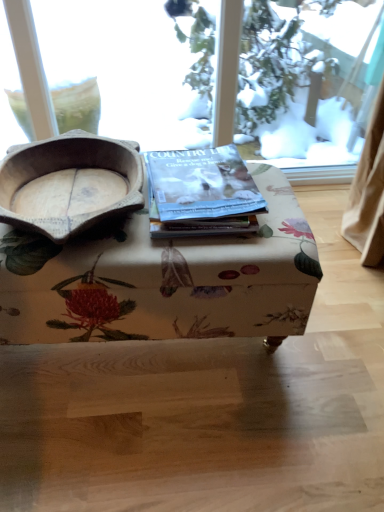
Locate an element on the screen. This screenshot has height=512, width=384. empty space that is ontop of floral fabric ottoman at center (from a real-world perspective) is located at coordinates (109, 193).